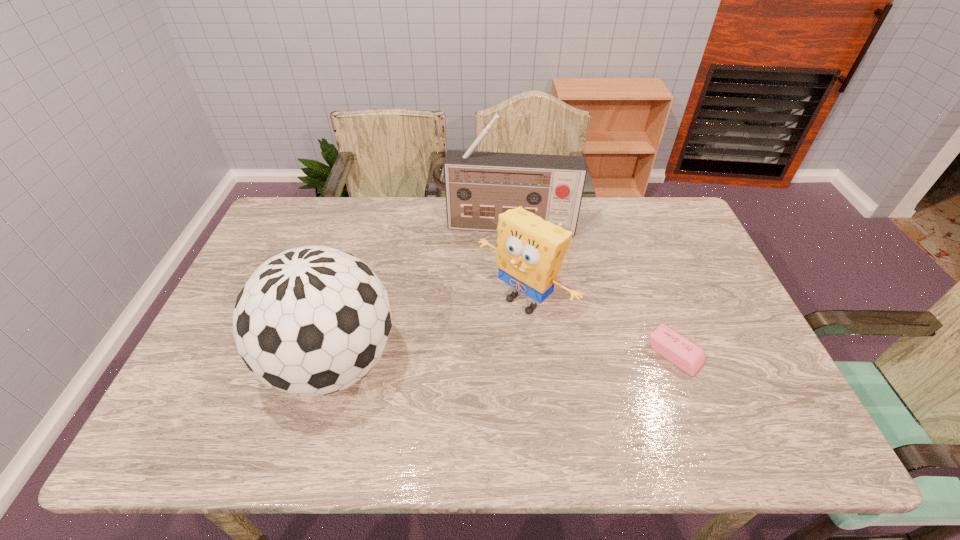
Where is `the third shortest object`? Image resolution: width=960 pixels, height=540 pixels. the third shortest object is located at coordinates (310, 321).

Identify the location of soccer ball. (310, 321).

At what (x,y) coordinates should I click in order to perform the action: click on the rightmost object. Please return your answer as a coordinate pair (x, y). The image size is (960, 540). Looking at the image, I should click on (690, 358).

Locate an element on the screen. eraser is located at coordinates (690, 358).

Image resolution: width=960 pixels, height=540 pixels. Identify the location of the farthest object. (479, 186).

The width and height of the screenshot is (960, 540). Identify the location of the third tallest object. (530, 251).

This screenshot has height=540, width=960. Identify the location of vacant point located on the left of the second tallest object. (223, 363).

Locate an element on the screen. Image resolution: width=960 pixels, height=540 pixels. free location located 0.110m on the right of the eraser is located at coordinates (744, 354).

Locate an element on the screen. vacant position located 0.060m on the front panel of the farthest object is located at coordinates (498, 251).

Where is `vacant space located 0.100m on the front panel of the farthest object`? The height and width of the screenshot is (540, 960). vacant space located 0.100m on the front panel of the farthest object is located at coordinates (497, 260).